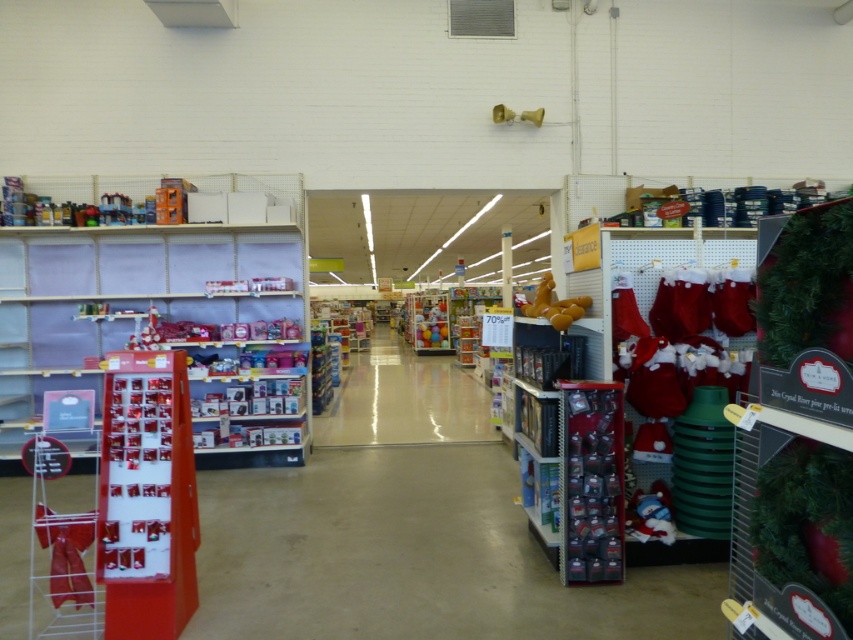
Which of these two, metallic silver ornaments at right or velvety plush toy at lower right, stands shorter?

velvety plush toy at lower right is shorter.

Does point (605, 460) lie behind point (643, 506)?

No, it is not.

Locate an element on the screen. This screenshot has height=640, width=853. metallic silver ornaments at right is located at coordinates (590, 483).

Describe the element at coordinates (172, 314) in the screenshot. Image resolution: width=853 pixels, height=640 pixels. I see `matte plastic shelves at upper left` at that location.

Can you confirm if matte plastic shelves at upper left is positioned above metallic silver ornaments at right?

Yes.

Locate an element on the screen. This screenshot has height=640, width=853. matte plastic shelves at upper left is located at coordinates (172, 314).

Find the location of a particular element. Image resolution: width=853 pixels, height=640 pixels. matte plastic shelves at upper left is located at coordinates (172, 314).

Who is shorter, matte plastic toy at center or velvety plush toy at lower right?

Standing shorter between the two is velvety plush toy at lower right.

Locate an element on the screen. matte plastic toy at center is located at coordinates (404, 400).